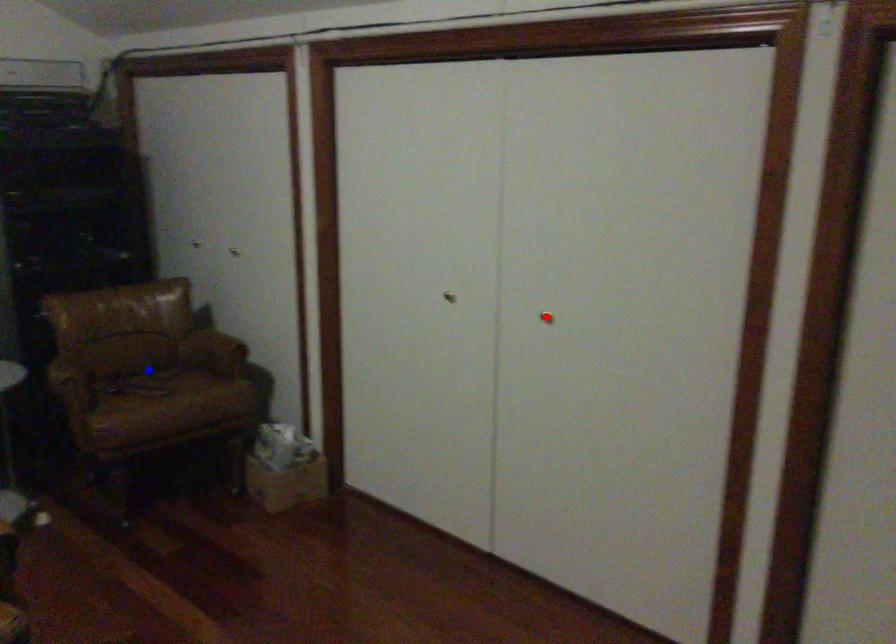
Question: Two points are marked on the image. Which point is closer to the camera?

Choices:
 (A) Blue point is closer.
 (B) Red point is closer.

Answer: (B)